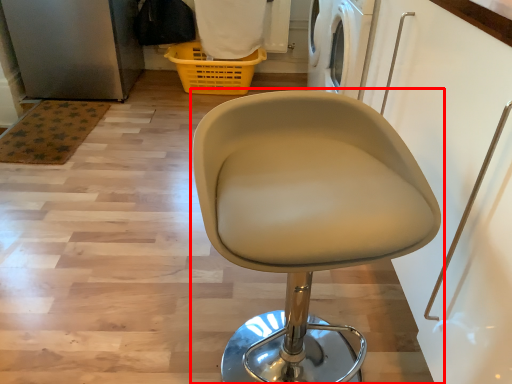
Question: Considering the relative positions of chair (annotated by the red box) and basket in the image provided, where is chair (annotated by the red box) located with respect to the staircase?

Choices:
 (A) right
 (B) left

Answer: (A)